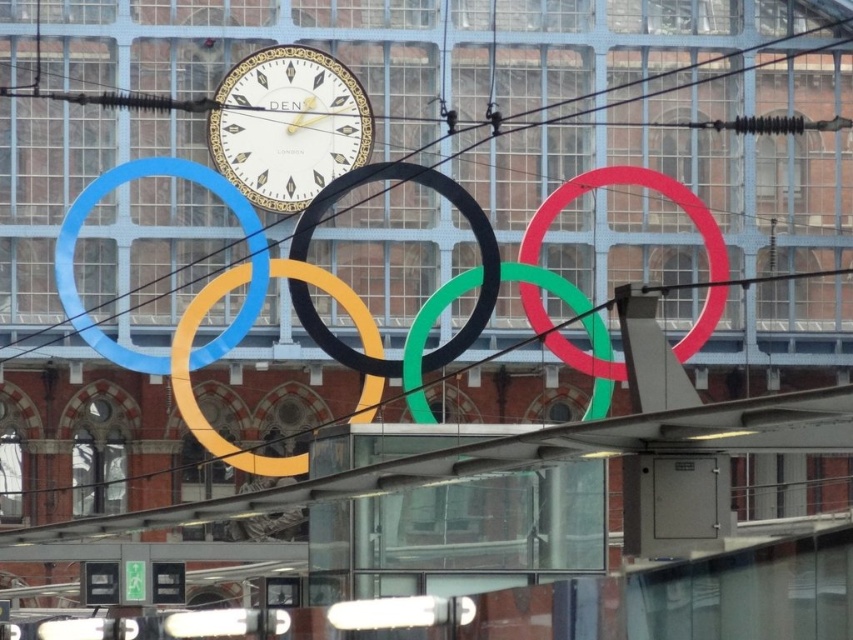
Question: Is black rubber circle at center to the left of green matte olympic ring at center from the viewer's perspective?

Choices:
 (A) no
 (B) yes

Answer: (B)

Question: Does matte yellow ring at center have a greater width compared to green matte olympic ring at center?

Choices:
 (A) no
 (B) yes

Answer: (A)

Question: Which point appears closest to the camera in this image?

Choices:
 (A) (556, 289)
 (B) (700, 346)

Answer: (A)

Question: Which of the following is the farthest from the observer?

Choices:
 (A) black rubber circle at center
 (B) matte yellow ring at center
 (C) matte gold clock at center
 (D) green rubber ring at center

Answer: (C)

Question: Can you confirm if matte gold clock at center is wider than blue rubber ring at center?

Choices:
 (A) yes
 (B) no

Answer: (B)

Question: Which point is closer to the camera taking this photo?

Choices:
 (A) (276, 211)
 (B) (508, 275)

Answer: (A)